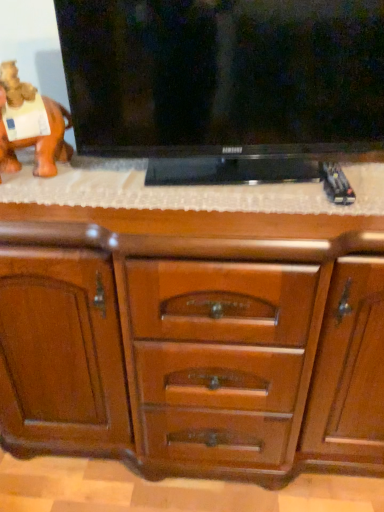
This screenshot has height=512, width=384. I want to click on vacant area that is in front of black glossy flat-screen tv at upper center, so click(238, 209).